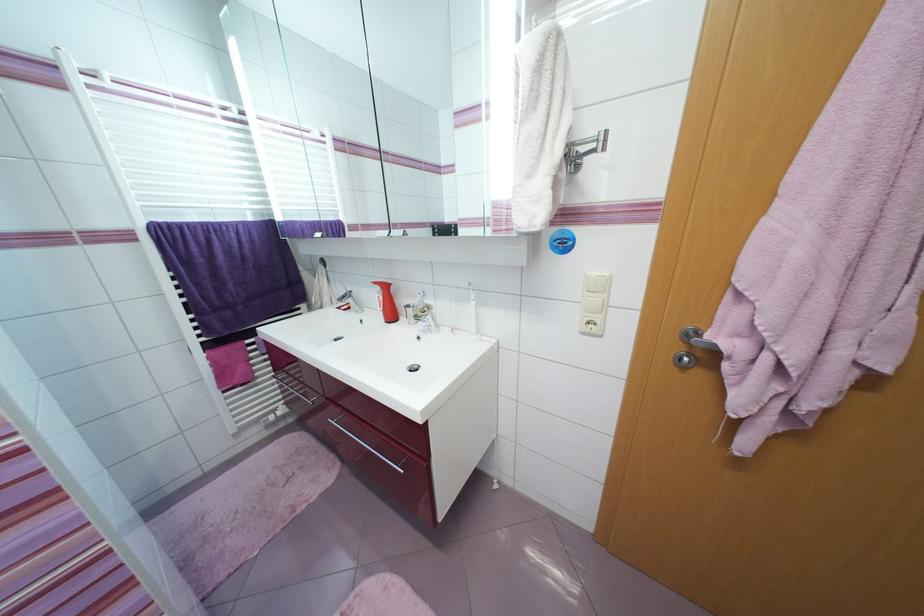
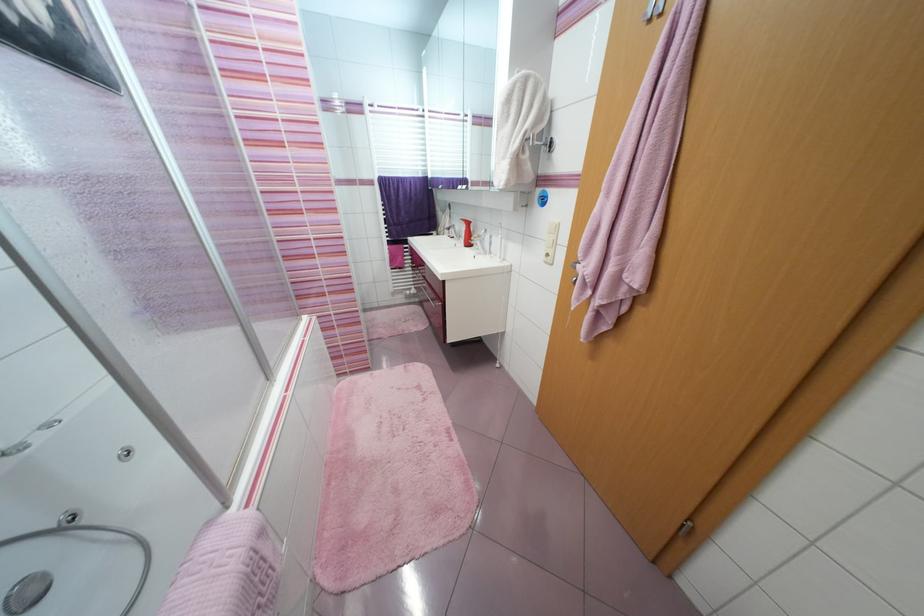
Find the pixel in the second image that matches point (588, 334) in the first image.

(551, 264)